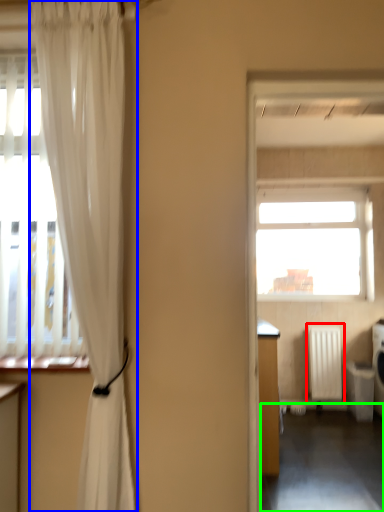
Question: Considering the real-world distances, which object is farthest from radiator (highlighted by a red box)? curtain (highlighted by a blue box) or corridor (highlighted by a green box)?

Choices:
 (A) curtain
 (B) corridor

Answer: (A)